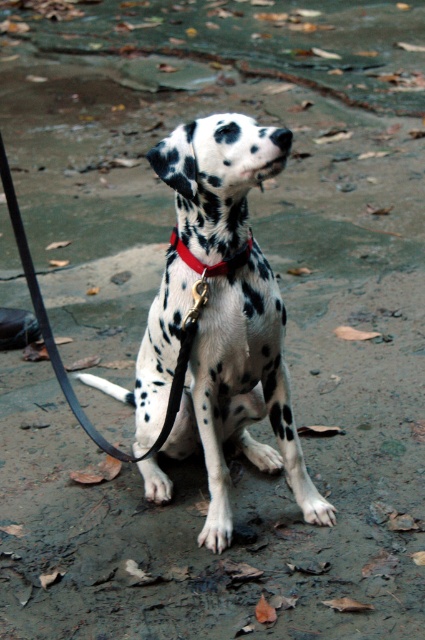
Question: Among these objects, which one is farthest from the camera?

Choices:
 (A) white-spotted fur dog at center
 (B) red leather collar at center

Answer: (B)

Question: Considering the relative positions of black leather leash at center and red leather collar at center in the image provided, where is black leather leash at center located with respect to red leather collar at center?

Choices:
 (A) above
 (B) below

Answer: (A)

Question: Does white-spotted fur dog at center have a smaller size compared to red leather collar at center?

Choices:
 (A) no
 (B) yes

Answer: (A)

Question: Which point appears farthest from the camera in this image?

Choices:
 (A) (23, 236)
 (B) (172, 240)

Answer: (A)

Question: Which of the following is the closest to the observer?

Choices:
 (A) (221, 273)
 (B) (226, 426)
 (C) (16, 204)

Answer: (A)

Question: Observing the image, what is the correct spatial positioning of black leather leash at center in reference to red leather collar at center?

Choices:
 (A) left
 (B) right

Answer: (A)